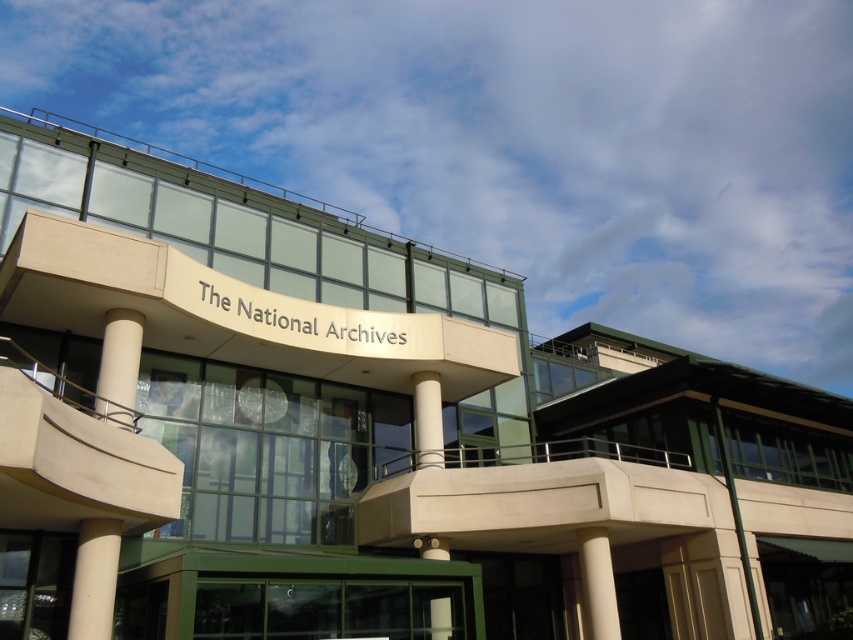
Question: Which point is farther to the camera?

Choices:
 (A) white smooth column at left
 (B) white smooth column at lower right
 (C) white glossy pillar at center

Answer: (B)

Question: Can you confirm if white smooth column at left is smaller than white glossy column at center?

Choices:
 (A) yes
 (B) no

Answer: (A)

Question: Which object is farther from the camera taking this photo?

Choices:
 (A) white smooth pillar at lower left
 (B) white smooth column at lower right
 (C) white glossy pillar at center

Answer: (B)

Question: Observing the image, what is the correct spatial positioning of white glossy pillar at center in reference to white glossy column at center?

Choices:
 (A) right
 (B) left

Answer: (B)

Question: Does white glossy pillar at center appear on the right side of white glossy column at center?

Choices:
 (A) no
 (B) yes

Answer: (A)

Question: Which of the following is the farthest from the observer?

Choices:
 (A) (434, 400)
 (B) (88, 586)
 (C) (589, 625)

Answer: (A)